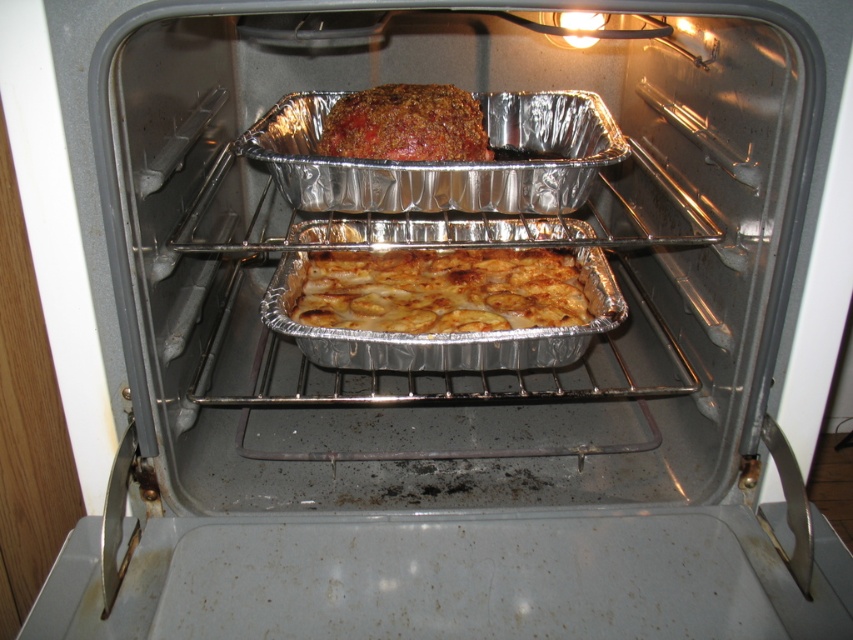
Question: Can you confirm if golden brown aluminum foil at center is smaller than baked brown meatloaf at center?

Choices:
 (A) no
 (B) yes

Answer: (A)

Question: Does golden brown aluminum foil at center have a greater width compared to baked brown meatloaf at center?

Choices:
 (A) yes
 (B) no

Answer: (A)

Question: Among these objects, which one is nearest to the camera?

Choices:
 (A) baked brown meatloaf at center
 (B) golden brown aluminum foil at center

Answer: (A)

Question: Which object appears farthest from the camera in this image?

Choices:
 (A) baked brown meatloaf at center
 (B) golden brown aluminum foil at center

Answer: (B)

Question: Which point is closer to the camera taking this photo?

Choices:
 (A) (521, 323)
 (B) (387, 93)

Answer: (A)

Question: Is golden brown aluminum foil at center closer to the viewer compared to baked brown meatloaf at center?

Choices:
 (A) yes
 (B) no

Answer: (B)